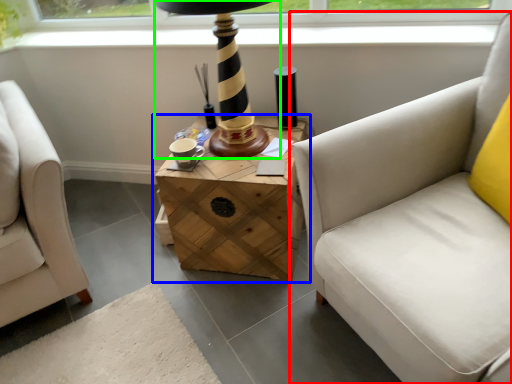
Question: Which is farther away from studio couch (highlighted by a red box)? table (highlighted by a blue box) or table lamp (highlighted by a green box)?

Choices:
 (A) table
 (B) table lamp

Answer: (B)